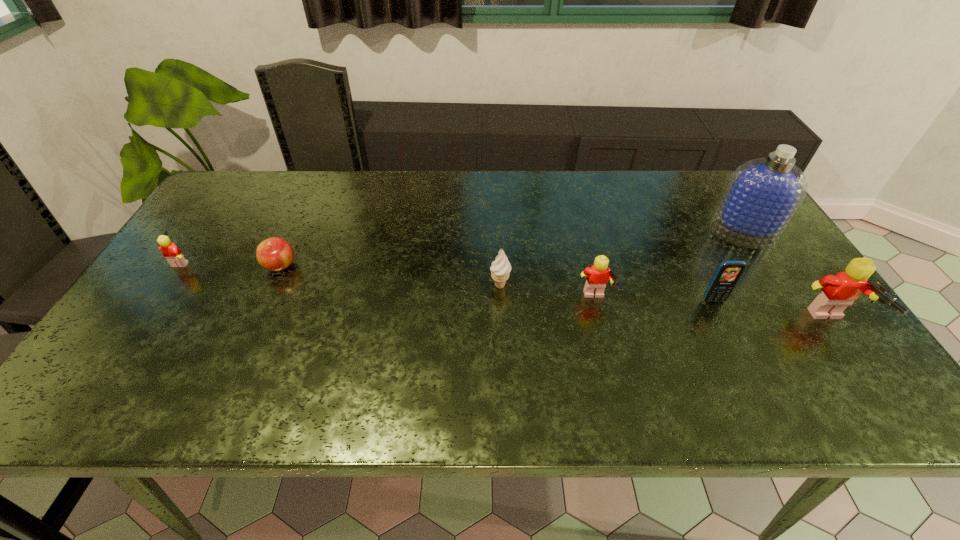
Please point a spot to place another Lego for symmetrical spacing. Please provide its 2D coordinates. Your answer should be formatted as a tuple, i.e. [(x, y)], where the tuple contains the x and y coordinates of a point satisfying the conditions above.

[(380, 279)]